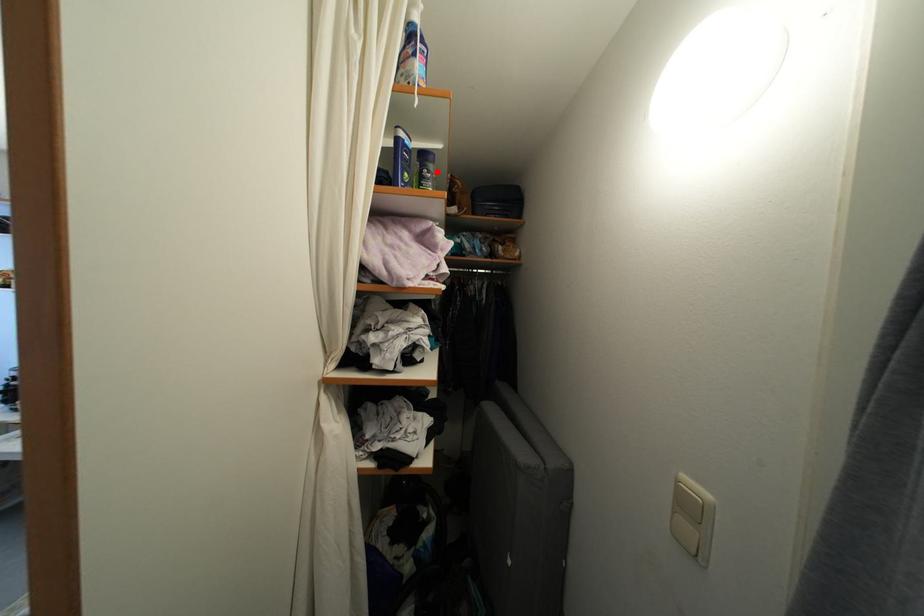
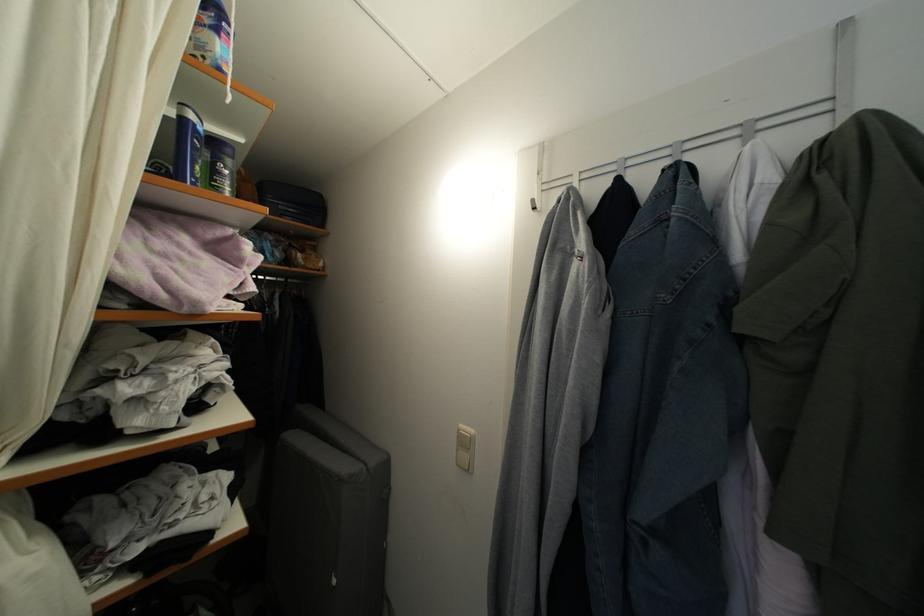
Find the pixel in the second image that matches the highlighted location in the first image.

(235, 168)